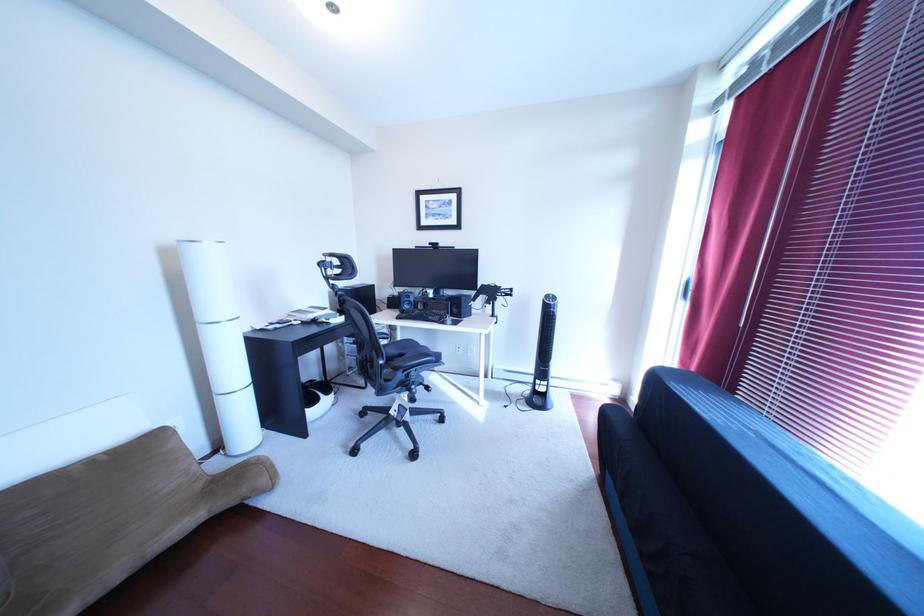
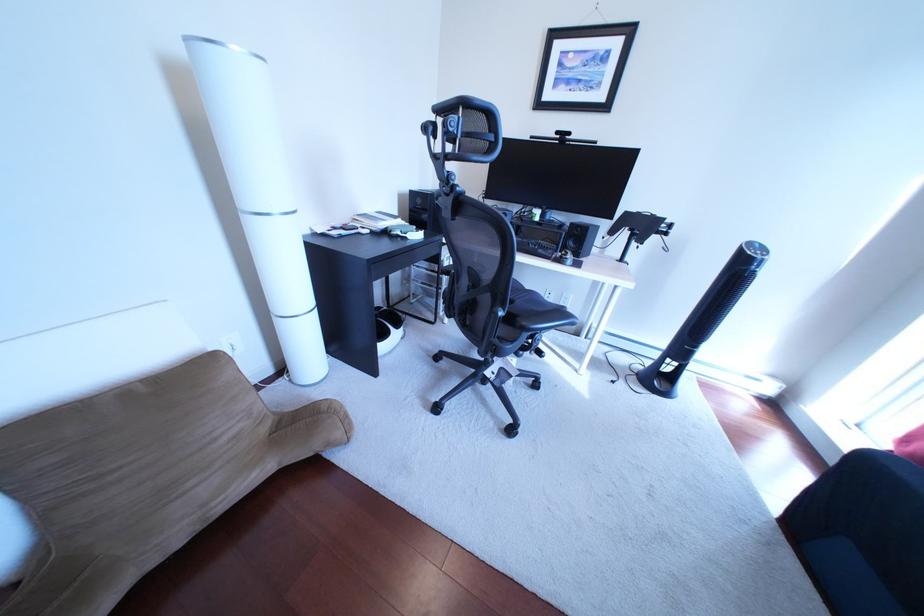
Which direction would the cameraman need to move to produce the second image?

The cameraman walked toward left, forward.